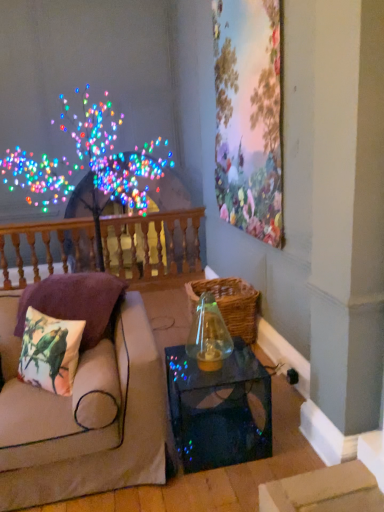
Measure the distance between point [201,340] and camera.

Point [201,340] is 2.36 meters from camera.

From the picture: What is the approximate width of transparent glass table at lower center?

transparent glass table at lower center is 19.44 inches wide.

What is the approximate height of floral wallpaper at upper right?

It is 6.24 feet.

You are a GUI agent. You are given a task and a screenshot of the screen. Output one action in this format:
    pyautogui.click(x=<x>, y=<y>)
    Task: Click on the printed fabric cushion with parrots at left, the first pillow when ordered from front to back
    The width and height of the screenshot is (384, 512).
    Given the screenshot: What is the action you would take?
    pyautogui.click(x=50, y=352)

Where is `woven brown basket at center`? woven brown basket at center is located at coordinates (231, 304).

Image resolution: width=384 pixels, height=512 pixels. What do you see at coordinates (231, 304) in the screenshot?
I see `woven brown basket at center` at bounding box center [231, 304].

The image size is (384, 512). In order to click on transparent glass vase at center in this screenshot , I will do `click(209, 335)`.

Where is `balustrade that appears behind the beige fabric couch at left`? balustrade that appears behind the beige fabric couch at left is located at coordinates (153, 247).

Does point (46, 275) come in front of point (96, 386)?

No, it is not.

Between wooden balustrade at upper left and beige fabric couch at left, which one has larger size?

beige fabric couch at left.

From the image's perspective, is wooden balustrade at upper left above or below beige fabric couch at left?

Based on their image positions, wooden balustrade at upper left is located above beige fabric couch at left.

Does printed fabric cushion with parrots at left, the first pillow when ordered from front to back, turn towards transparent glass vase at center?

No.

Can you confirm if printed fabric cushion with parrots at left, arranged as the 2th pillow when viewed from the back, is positioned to the left of transparent glass vase at center?

Indeed, printed fabric cushion with parrots at left, arranged as the 2th pillow when viewed from the back, is positioned on the left side of transparent glass vase at center.

Is point (64, 389) closer or farther from the camera than point (216, 327)?

Point (64, 389) appears to be closer to the viewer than point (216, 327).

From a real-world perspective, between printed fabric cushion with parrots at left, arranged as the 2th pillow when viewed from the back, and transparent glass vase at center, who is vertically lower?

printed fabric cushion with parrots at left, arranged as the 2th pillow when viewed from the back.

Considering the sizes of objects transparent glass vase at center and wooden balustrade at upper left in the image provided, who is thinner, transparent glass vase at center or wooden balustrade at upper left?

With smaller width is wooden balustrade at upper left.

Is transparent glass vase at center not within wooden balustrade at upper left?

Yes, transparent glass vase at center is located beyond the bounds of wooden balustrade at upper left.

From a real-world perspective, between transparent glass vase at center and wooden balustrade at upper left, who is vertically higher?

transparent glass vase at center is physically above.

Which object is positioned more to the left, transparent glass vase at center or wooden balustrade at upper left?

wooden balustrade at upper left.

Which pillow is the 2nd one when counting from the left side of the transparent glass table at lower center? Please provide its 2D coordinates.

[(50, 352)]

Relative to printed fabric cushion with parrots at left, the first pillow when ordered from front to back, is transparent glass table at lower center in front or behind?

transparent glass table at lower center is behind printed fabric cushion with parrots at left, the first pillow when ordered from front to back.

Would you say transparent glass table at lower center contains printed fabric cushion with parrots at left, arranged as the 2th pillow when viewed from the back?

No, printed fabric cushion with parrots at left, arranged as the 2th pillow when viewed from the back, is located outside of transparent glass table at lower center.

Is floral wallpaper at upper right facing towards transparent glass table at lower center?

Result: No, floral wallpaper at upper right is not oriented towards transparent glass table at lower center.

From their relative heights in the image, would you say floral wallpaper at upper right is taller or shorter than transparent glass table at lower center?

Clearly, floral wallpaper at upper right is taller compared to transparent glass table at lower center.

From the picture: From a real-world perspective, is floral wallpaper at upper right positioned under transparent glass table at lower center based on gravity?

No, from a real-world perspective, floral wallpaper at upper right is not below transparent glass table at lower center.

Is beige fabric couch at left touching printed fabric cushion at left, placed as the 1th pillow when sorted from back to front?

No, beige fabric couch at left is not next to printed fabric cushion at left, placed as the 1th pillow when sorted from back to front.

From the image's perspective, relative to printed fabric cushion at left, placed as the 1th pillow when sorted from back to front, is beige fabric couch at left above or below?

Based on their image positions, beige fabric couch at left is located beneath printed fabric cushion at left, placed as the 1th pillow when sorted from back to front.

From a real-world perspective, is beige fabric couch at left positioned over printed fabric cushion at left, which is the 2th pillow in front-to-back order, based on gravity?

No, from a real-world perspective, beige fabric couch at left is not on top of printed fabric cushion at left, which is the 2th pillow in front-to-back order.

What's the angular difference between printed fabric cushion with parrots at left, arranged as the 2th pillow when viewed from the back, and woven brown basket at center's facing directions?

The facing directions of printed fabric cushion with parrots at left, arranged as the 2th pillow when viewed from the back, and woven brown basket at center are 45.7 degrees apart.

Does printed fabric cushion with parrots at left, arranged as the 2th pillow when viewed from the back, have a greater height compared to woven brown basket at center?

In fact, printed fabric cushion with parrots at left, arranged as the 2th pillow when viewed from the back, may be shorter than woven brown basket at center.

Is printed fabric cushion with parrots at left, the first pillow when ordered from front to back, bigger or smaller than woven brown basket at center?

Clearly, printed fabric cushion with parrots at left, the first pillow when ordered from front to back, is smaller in size than woven brown basket at center.

Is printed fabric cushion with parrots at left, the first pillow when ordered from front to back, beside woven brown basket at center?

No.

The height and width of the screenshot is (512, 384). I want to click on balustrade located on the left of beige fabric couch at left, so click(153, 247).

Where is `glass vase that is on the right side of printed fabric cushion with parrots at left, the first pillow when ordered from front to back`? Image resolution: width=384 pixels, height=512 pixels. glass vase that is on the right side of printed fabric cushion with parrots at left, the first pillow when ordered from front to back is located at coordinates (209, 335).

Based on the photo, from the image, which object appears to be nearer to beige fabric couch at left, wooden balustrade at upper left or woven brown basket at center?

woven brown basket at center is positioned closer to the anchor beige fabric couch at left.

Looking at the image, which one is located further to woven brown basket at center, floral wallpaper at upper right or beige fabric couch at left?

The object further to woven brown basket at center is beige fabric couch at left.

Estimate the real-world distances between objects in this image. Which object is closer to transparent glass vase at center, printed fabric cushion at left, which is the 2th pillow in front-to-back order, or printed fabric cushion with parrots at left, arranged as the 2th pillow when viewed from the back?

Among the two, printed fabric cushion at left, which is the 2th pillow in front-to-back order, is located nearer to transparent glass vase at center.

When comparing their distances from transparent glass vase at center, does floral wallpaper at upper right or printed fabric cushion at left, which is the 2th pillow in front-to-back order, seem further?

floral wallpaper at upper right lies further to transparent glass vase at center than the other object.

Based on their spatial positions, is woven brown basket at center or floral wallpaper at upper right further from printed fabric cushion with parrots at left, arranged as the 2th pillow when viewed from the back?

Based on the image, floral wallpaper at upper right appears to be further to printed fabric cushion with parrots at left, arranged as the 2th pillow when viewed from the back.

From the image, which object appears to be farther from floral wallpaper at upper right, wooden balustrade at upper left or beige fabric couch at left?

The object further to floral wallpaper at upper right is wooden balustrade at upper left.

Based on their spatial positions, is transparent glass vase at center or beige fabric couch at left closer to printed fabric cushion at left, placed as the 1th pillow when sorted from back to front?

beige fabric couch at left is positioned closer to the anchor printed fabric cushion at left, placed as the 1th pillow when sorted from back to front.

From the image, which object appears to be nearer to floral wallpaper at upper right, transparent glass vase at center or printed fabric cushion at left, which is the 2th pillow in front-to-back order?

transparent glass vase at center lies closer to floral wallpaper at upper right than the other object.

Find the location of a particular element. The height and width of the screenshot is (512, 384). pillow between floral wallpaper at upper right and transparent glass vase at center from top to bottom is located at coordinates (76, 303).

At what (x,y) coordinates should I click in order to perform the action: click on picture frame between printed fabric cushion at left, which is the 2th pillow in front-to-back order, and wooden balustrade at upper left, along the z-axis. Please return your answer as a coordinate pair (x, y). Image resolution: width=384 pixels, height=512 pixels. Looking at the image, I should click on (249, 115).

Locate an element on the screen. This screenshot has width=384, height=512. table located between transparent glass vase at center and wooden balustrade at upper left in the depth direction is located at coordinates (219, 409).

What are the coordinates of `pillow between transparent glass table at lower center and woven brown basket at center along the z-axis` in the screenshot? It's located at (76, 303).